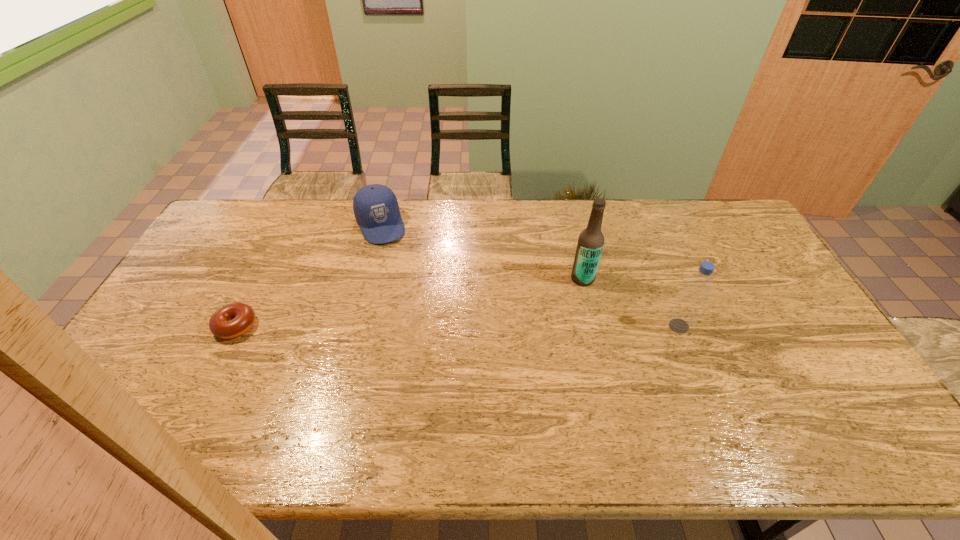
This screenshot has width=960, height=540. I want to click on free space on the desktop that is between the doughnut and the second tallest object and is positioned on the side of the third nearest object with the label, so click(x=490, y=326).

The height and width of the screenshot is (540, 960). Find the location of `vacant spot on the desktop that is between the shortest object and the bottle and is positioned on the front-facing side of the cap`. vacant spot on the desktop that is between the shortest object and the bottle and is positioned on the front-facing side of the cap is located at coordinates [x=426, y=326].